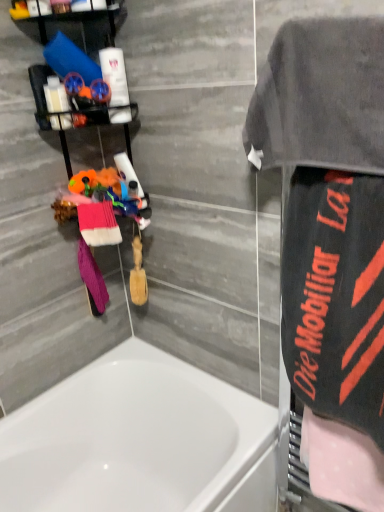
What do you see at coordinates (322, 98) in the screenshot?
I see `gray terry cloth towel at upper right` at bounding box center [322, 98].

Where is `pink terry cloth beach towel at left, which is counted as the second beach towel, starting from the left`? The height and width of the screenshot is (512, 384). pink terry cloth beach towel at left, which is counted as the second beach towel, starting from the left is located at coordinates (98, 224).

Find the location of a particular element. black fabric towel at right, placed as the fourth beach towel when sorted from left to right is located at coordinates (335, 296).

Describe the element at coordinates (342, 463) in the screenshot. I see `pink polka dot towel at right, the 1th beach towel when ordered from right to left` at that location.

Describe the element at coordinates (116, 84) in the screenshot. I see `white glossy lotion at upper left, the 2th toiletry positioned from the left` at that location.

What do you see at coordinates (56, 96) in the screenshot? The image size is (384, 512). I see `matte plastic bottles at upper left, the 1th toiletry from the left` at bounding box center [56, 96].

Where is `gray terry cloth towel at upper right`? gray terry cloth towel at upper right is located at coordinates (322, 98).

Between white glossy bathtub at lower left and purple knitted towel at lower left, marked as the first beach towel in a left-to-right arrangement, which one has larger width?

white glossy bathtub at lower left is wider.

Could you tell me if white glossy bathtub at lower left is turned towards purple knitted towel at lower left, marked as the first beach towel in a left-to-right arrangement?

No.

From a real-world perspective, who is located higher, white glossy bathtub at lower left or purple knitted towel at lower left, marked as the first beach towel in a left-to-right arrangement?

purple knitted towel at lower left, marked as the first beach towel in a left-to-right arrangement, from a real-world perspective.

Is white glossy bathtub at lower left further to the viewer compared to purple knitted towel at lower left, positioned as the fifth beach towel in right-to-left order?

No, the depth of white glossy bathtub at lower left is less than that of purple knitted towel at lower left, positioned as the fifth beach towel in right-to-left order.

Can you confirm if white glossy lotion at upper left, positioned as the 1th toiletry in right-to-left order, is smaller than gray terry cloth towel at upper right?

Yes, white glossy lotion at upper left, positioned as the 1th toiletry in right-to-left order, is smaller than gray terry cloth towel at upper right.

In the scene shown: Which object is further away from the camera taking this photo, white glossy lotion at upper left, the 2th toiletry positioned from the left, or gray terry cloth towel at upper right?

white glossy lotion at upper left, the 2th toiletry positioned from the left, is further away from the camera.

Do you think white glossy lotion at upper left, positioned as the 1th toiletry in right-to-left order, is within gray terry cloth towel at upper right, or outside of it?

The correct answer is: outside.

Does point (111, 67) come behind point (250, 113)?

Yes, point (111, 67) is farther from viewer.

I want to click on the 1st toiletry positioned above the purple knitted towel at lower left, positioned as the fifth beach towel in right-to-left order (from a real-world perspective), so click(x=56, y=96).

Can you confirm if matte plastic bottles at upper left, the 1th toiletry from the left, is shorter than purple knitted towel at lower left, marked as the first beach towel in a left-to-right arrangement?

Yes, matte plastic bottles at upper left, the 1th toiletry from the left, is shorter than purple knitted towel at lower left, marked as the first beach towel in a left-to-right arrangement.

Between point (65, 119) and point (105, 288), which one is positioned in front?

The point (65, 119) is in front.

Based on the photo, how far apart are matte plastic bottles at upper left, the 1th toiletry from the left, and purple knitted towel at lower left, marked as the first beach towel in a left-to-right arrangement?

19.15 inches.

Is point (45, 95) more distant than point (318, 29)?

Yes.

From the image's perspective, is matte plastic bottles at upper left, the 1th toiletry from the left, positioned above or below gray terry cloth towel at upper right?

matte plastic bottles at upper left, the 1th toiletry from the left, is situated higher than gray terry cloth towel at upper right in the image.

Who is taller, matte plastic bottles at upper left, the 1th toiletry from the left, or gray terry cloth towel at upper right?

With more height is gray terry cloth towel at upper right.

Which object is wider, matte plastic bottles at upper left, the 2th toiletry when ordered from right to left, or gray terry cloth towel at upper right?

Wider between the two is gray terry cloth towel at upper right.

Is matte plastic bottles at upper left, the 2th toiletry when ordered from right to left, surrounded by pink polka dot towel at right, acting as the 5th beach towel starting from the left?

No.

Does pink polka dot towel at right, the 1th beach towel when ordered from right to left, have a smaller size compared to matte plastic bottles at upper left, the 1th toiletry from the left?

No, pink polka dot towel at right, the 1th beach towel when ordered from right to left, is not smaller than matte plastic bottles at upper left, the 1th toiletry from the left.

Based on the photo, is pink polka dot towel at right, the 1th beach towel when ordered from right to left, oriented towards matte plastic bottles at upper left, the 1th toiletry from the left?

No.

Consider the image. Does pink polka dot towel at right, the 1th beach towel when ordered from right to left, have a greater height compared to matte plastic bottles at upper left, the 1th toiletry from the left?

Yes.

How different are the orientations of gray terry cloth towel at upper right, which appears as the third beach towel when viewed from the right, and pink polka dot towel at right, acting as the 5th beach towel starting from the left, in degrees?

1.36 degrees separate the facing orientations of gray terry cloth towel at upper right, which appears as the third beach towel when viewed from the right, and pink polka dot towel at right, acting as the 5th beach towel starting from the left.

Are gray terry cloth towel at upper right, which appears as the third beach towel when viewed from the right, and pink polka dot towel at right, acting as the 5th beach towel starting from the left, making contact?

They are not placed beside each other.

From a real-world perspective, is gray terry cloth towel at upper right, acting as the 3th beach towel starting from the left, physically located above or below pink polka dot towel at right, the 1th beach towel when ordered from right to left?

Clearly, from a real-world perspective, gray terry cloth towel at upper right, acting as the 3th beach towel starting from the left, is above pink polka dot towel at right, the 1th beach towel when ordered from right to left.

From the image's perspective, is gray terry cloth towel at upper right, which appears as the third beach towel when viewed from the right, above pink polka dot towel at right, acting as the 5th beach towel starting from the left?

Yes, from the image's perspective, gray terry cloth towel at upper right, which appears as the third beach towel when viewed from the right, is over pink polka dot towel at right, acting as the 5th beach towel starting from the left.

Can you tell me how much purple knitted towel at lower left, marked as the first beach towel in a left-to-right arrangement, and black fabric towel at right, placed as the fourth beach towel when sorted from left to right, differ in facing direction?

There is a 120-degree angle between the facing directions of purple knitted towel at lower left, marked as the first beach towel in a left-to-right arrangement, and black fabric towel at right, placed as the fourth beach towel when sorted from left to right.

From the image's perspective, is purple knitted towel at lower left, positioned as the fifth beach towel in right-to-left order, on black fabric towel at right, placed as the fourth beach towel when sorted from left to right?

Indeed, from the image's perspective, purple knitted towel at lower left, positioned as the fifth beach towel in right-to-left order, is shown above black fabric towel at right, placed as the fourth beach towel when sorted from left to right.

Based on the photo, which of these two, purple knitted towel at lower left, marked as the first beach towel in a left-to-right arrangement, or black fabric towel at right, marked as the 2th beach towel in a right-to-left arrangement, is thinner?

Thinner between the two is purple knitted towel at lower left, marked as the first beach towel in a left-to-right arrangement.

From the picture: Is purple knitted towel at lower left, marked as the first beach towel in a left-to-right arrangement, to the left of black fabric towel at right, marked as the 2th beach towel in a right-to-left arrangement, from the viewer's perspective?

Yes, purple knitted towel at lower left, marked as the first beach towel in a left-to-right arrangement, is to the left of black fabric towel at right, marked as the 2th beach towel in a right-to-left arrangement.

From the image's perspective, count 3rd beach towels upward from the white glossy bathtub at lower left and point to it. Please provide its 2D coordinates.

[(92, 279)]

Image resolution: width=384 pixels, height=512 pixels. In order to click on the 2nd toiletry above the gray terry cloth towel at upper right (from a real-world perspective) in this screenshot , I will do `click(116, 84)`.

From the image, which object appears to be nearer to pink polka dot towel at right, the 1th beach towel when ordered from right to left, pink terry cloth beach towel at left, which is the 4th beach towel from right to left, or matte plastic bottles at upper left, the 1th toiletry from the left?

pink terry cloth beach towel at left, which is the 4th beach towel from right to left, is closer to pink polka dot towel at right, the 1th beach towel when ordered from right to left.

Looking at the image, which one is located further to gray terry cloth towel at upper right, acting as the 3th beach towel starting from the left, black fabric towel at right, marked as the 2th beach towel in a right-to-left arrangement, or pink polka dot towel at right, acting as the 5th beach towel starting from the left?

pink polka dot towel at right, acting as the 5th beach towel starting from the left, lies further to gray terry cloth towel at upper right, acting as the 3th beach towel starting from the left, than the other object.

From the image, which object appears to be farther from gray terry cloth towel at upper right, which appears as the third beach towel when viewed from the right, pink terry cloth beach towel at left, which is counted as the second beach towel, starting from the left, or black fabric towel at right, marked as the 2th beach towel in a right-to-left arrangement?

Among the two, pink terry cloth beach towel at left, which is counted as the second beach towel, starting from the left, is located further to gray terry cloth towel at upper right, which appears as the third beach towel when viewed from the right.

Based on their spatial positions, is white glossy bathtub at lower left or white glossy lotion at upper left, positioned as the 1th toiletry in right-to-left order, closer to black fabric towel at right, marked as the 2th beach towel in a right-to-left arrangement?

white glossy bathtub at lower left is positioned closer to the anchor black fabric towel at right, marked as the 2th beach towel in a right-to-left arrangement.

When comparing their distances from gray terry cloth towel at upper right, does pink terry cloth beach towel at left, which is the 4th beach towel from right to left, or gray terry cloth towel at upper right, which appears as the third beach towel when viewed from the right, seem further?

Based on the image, pink terry cloth beach towel at left, which is the 4th beach towel from right to left, appears to be further to gray terry cloth towel at upper right.

From the image, which object appears to be nearer to black fabric towel at right, placed as the fourth beach towel when sorted from left to right, white glossy bathtub at lower left or pink polka dot towel at right, acting as the 5th beach towel starting from the left?

pink polka dot towel at right, acting as the 5th beach towel starting from the left, is closer to black fabric towel at right, placed as the fourth beach towel when sorted from left to right.

When comparing their distances from gray terry cloth towel at upper right, which appears as the third beach towel when viewed from the right, does matte plastic bottles at upper left, the 1th toiletry from the left, or gray terry cloth towel at upper right seem further?

matte plastic bottles at upper left, the 1th toiletry from the left, lies further to gray terry cloth towel at upper right, which appears as the third beach towel when viewed from the right, than the other object.

From the image, which object appears to be farther from purple knitted towel at lower left, marked as the first beach towel in a left-to-right arrangement, matte plastic bottles at upper left, the 2th toiletry when ordered from right to left, or gray terry cloth towel at upper right?

gray terry cloth towel at upper right is positioned further to the anchor purple knitted towel at lower left, marked as the first beach towel in a left-to-right arrangement.

Identify the location of toiletry situated between pink terry cloth beach towel at left, which is counted as the second beach towel, starting from the left, and black fabric towel at right, marked as the 2th beach towel in a right-to-left arrangement, from left to right. (116, 84).

Locate an element on the screen. bathrobe between white glossy lotion at upper left, positioned as the 1th toiletry in right-to-left order, and white glossy bathtub at lower left from top to bottom is located at coordinates (322, 98).

Identify the location of bathtub positioned between gray terry cloth towel at upper right and purple knitted towel at lower left, marked as the first beach towel in a left-to-right arrangement, from near to far. (139, 441).

The width and height of the screenshot is (384, 512). In order to click on beach towel between black fabric towel at right, placed as the fourth beach towel when sorted from left to right, and white glossy bathtub at lower left from top to bottom in this screenshot , I will do `click(342, 463)`.